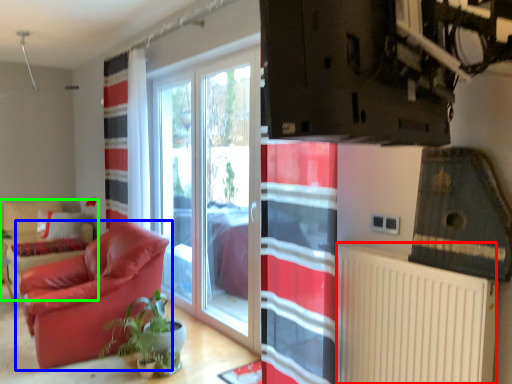
Question: Which object is positioned farthest from radiator (highlighted by a red box)? Select from chair (highlighted by a blue box) and armchair (highlighted by a green box).

Choices:
 (A) chair
 (B) armchair

Answer: (B)